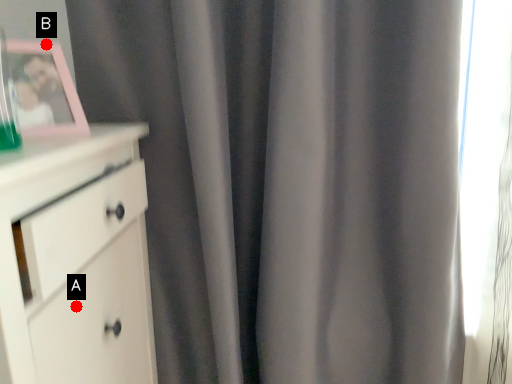
Question: Two points are circled on the image, labeled by A and B beside each circle. Which point is closer to the camera?

Choices:
 (A) A is closer
 (B) B is closer

Answer: (A)